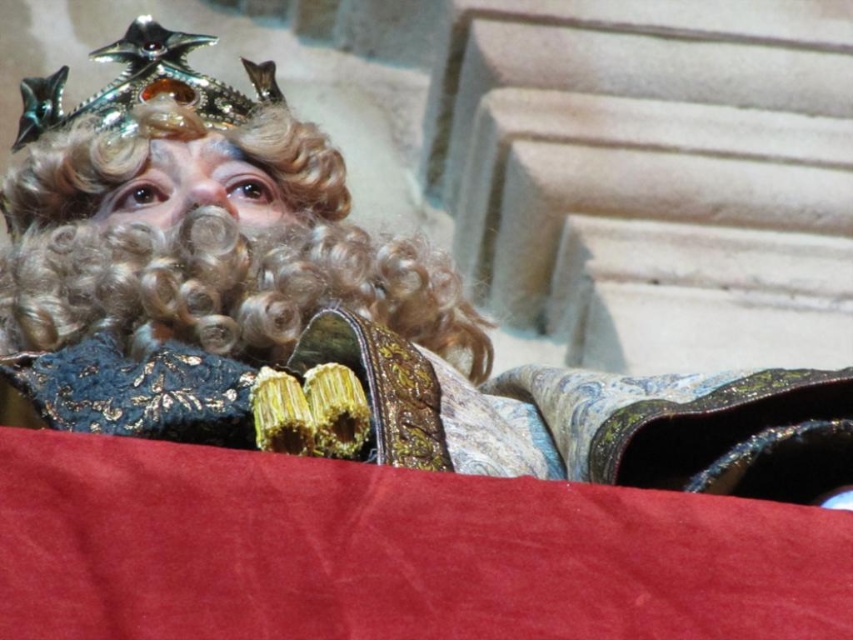
Does curly blonde wig at upper center have a larger size compared to shiny metallic crown at upper left?

Incorrect, curly blonde wig at upper center is not larger than shiny metallic crown at upper left.

Is curly blonde wig at upper center to the left of shiny metallic crown at upper left from the viewer's perspective?

In fact, curly blonde wig at upper center is to the right of shiny metallic crown at upper left.

At what (x,y) coordinates should I click in order to perform the action: click on curly blonde wig at upper center. Please return your answer as a coordinate pair (x, y). This screenshot has width=853, height=640. Looking at the image, I should click on point(212,248).

Can you confirm if velvet/goldenobject at center is positioned to the right of curly blonde wig at upper center?

Yes, velvet/goldenobject at center is to the right of curly blonde wig at upper center.

Measure the distance between point (576,410) and camera.

A distance of 55.83 meters exists between point (576,410) and camera.

Measure the distance between point [416,381] and camera.

Point [416,381] and camera are 53.75 meters apart from each other.

Identify the location of velvet/goldenobject at center. (596, 419).

Is the position of velvet/goldenobject at center more distant than that of shiny metallic crown at upper left?

That is False.

Who is higher up, velvet/goldenobject at center or shiny metallic crown at upper left?

Positioned higher is shiny metallic crown at upper left.

Which is in front, point (107, 364) or point (277, 90)?

Point (107, 364) is more forward.

In order to click on velvet/goldenobject at center in this screenshot , I will do `click(596, 419)`.